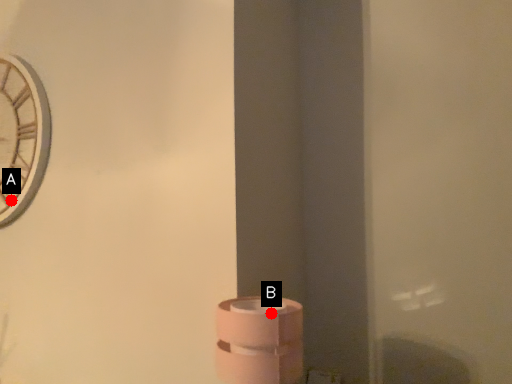
Question: Two points are circled on the image, labeled by A and B beside each circle. Which point is closer to the camera taking this photo?

Choices:
 (A) A is closer
 (B) B is closer

Answer: (B)